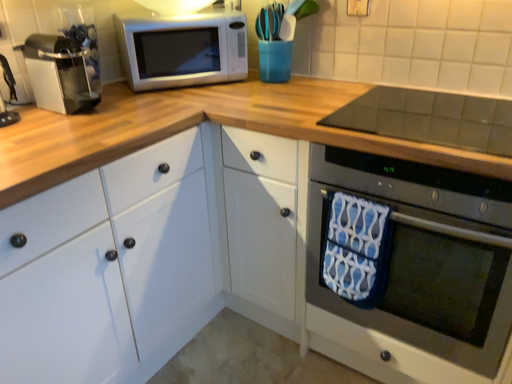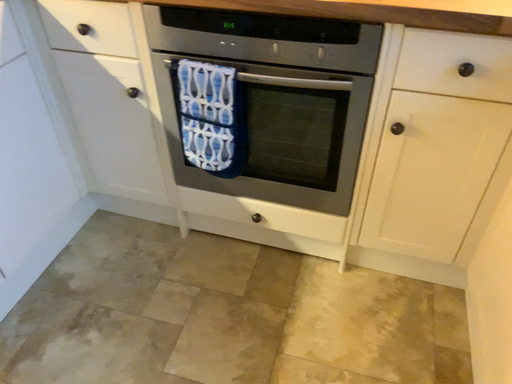
Question: Which way did the camera rotate in the video?

Choices:
 (A) rotated upward
 (B) rotated downward

Answer: (B)